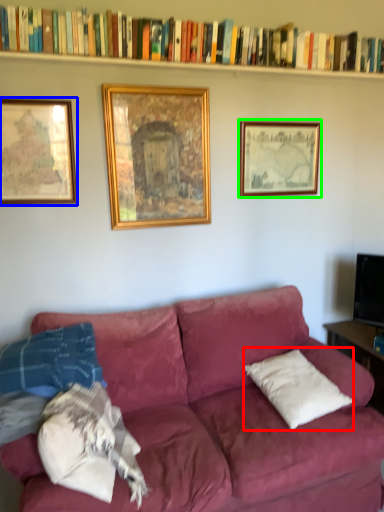
Question: Which object is the farthest from pillow (highlighted by a red box)? Choose among these: picture frame (highlighted by a blue box) or picture frame (highlighted by a green box).

Choices:
 (A) picture frame
 (B) picture frame

Answer: (A)